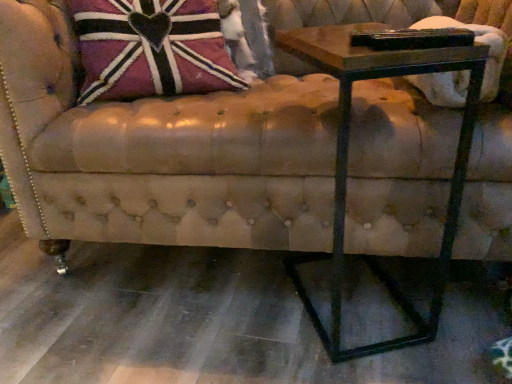
Locate an element on the screen. wooden table at right is located at coordinates (348, 149).

In order to click on wooden table at right in this screenshot , I will do `click(348, 149)`.

How different are the orientations of leather-like union jack pillow at upper left and wooden table at right in degrees?

leather-like union jack pillow at upper left and wooden table at right are facing 168 degrees away from each other.

Considering the relative sizes of leather-like union jack pillow at upper left and wooden table at right in the image provided, is leather-like union jack pillow at upper left wider than wooden table at right?

Incorrect, the width of leather-like union jack pillow at upper left does not surpass that of wooden table at right.

Can you confirm if leather-like union jack pillow at upper left is positioned to the left of wooden table at right?

Correct, you'll find leather-like union jack pillow at upper left to the left of wooden table at right.

The image size is (512, 384). Find the location of `throw pillow on the left of the wooden table at right`. throw pillow on the left of the wooden table at right is located at coordinates (160, 48).

Is leather couch at center located outside wooden table at right?

leather couch at center lies outside wooden table at right's area.

Which of these two, leather couch at center or wooden table at right, is wider?

With larger width is leather couch at center.

Is leather couch at center next to wooden table at right?

There is a gap between leather couch at center and wooden table at right.

From a real-world perspective, is wooden table at right beneath leather-like union jack pillow at upper left?

Yes, from a real-world perspective, wooden table at right is beneath leather-like union jack pillow at upper left.

Which is in front, point (443, 51) or point (208, 56)?

The point (443, 51) is closer.

Is wooden table at right bigger or smaller than leather-like union jack pillow at upper left?

In the image, wooden table at right appears to be larger than leather-like union jack pillow at upper left.

Are wooden table at right and leather couch at center far apart?

No, wooden table at right is in close proximity to leather couch at center.

Which object is further away from the camera, wooden table at right or leather couch at center?

leather couch at center is behind.

Is point (339, 297) farther from viewer compared to point (175, 234)?

That is True.

Based on the photo, which of these two, leather-like union jack pillow at upper left or leather couch at center, stands shorter?

leather-like union jack pillow at upper left.

Considering the positions of objects leather-like union jack pillow at upper left and leather couch at center in the image provided, who is in front, leather-like union jack pillow at upper left or leather couch at center?

leather couch at center is more forward.

From the image's perspective, which one is positioned lower, leather-like union jack pillow at upper left or leather couch at center?

leather couch at center appears lower in the image.

At what (x,y) coordinates should I click in order to perform the action: click on studio couch lying in front of the leather-like union jack pillow at upper left. Please return your answer as a coordinate pair (x, y). Image resolution: width=512 pixels, height=384 pixels. Looking at the image, I should click on (161, 152).

In order to click on throw pillow located behind the leather couch at center in this screenshot , I will do `click(160, 48)`.

Is point (307, 220) positioned in front of point (121, 65)?

Yes, it is in front of point (121, 65).

From their relative heights in the image, would you say leather couch at center is taller or shorter than leather-like union jack pillow at upper left?

leather couch at center is taller than leather-like union jack pillow at upper left.

Can you confirm if leather couch at center is bigger than leather-like union jack pillow at upper left?

Indeed, leather couch at center has a larger size compared to leather-like union jack pillow at upper left.

Find the location of a particular element. throw pillow above the wooden table at right (from the image's perspective) is located at coordinates (160, 48).

The height and width of the screenshot is (384, 512). Identify the location of studio couch that appears on the left of wooden table at right. (x=161, y=152).

Based on their spatial positions, is wooden table at right or leather-like union jack pillow at upper left further from leather couch at center?

The object further to leather couch at center is leather-like union jack pillow at upper left.

Which object lies further to the anchor point wooden table at right, leather couch at center or leather-like union jack pillow at upper left?

Based on the image, leather-like union jack pillow at upper left appears to be further to wooden table at right.

Based on their spatial positions, is leather-like union jack pillow at upper left or wooden table at right further from leather couch at center?

leather-like union jack pillow at upper left.

Estimate the real-world distances between objects in this image. Which object is closer to wooden table at right, leather-like union jack pillow at upper left or leather couch at center?

The object closer to wooden table at right is leather couch at center.

From the picture: Estimate the real-world distances between objects in this image. Which object is closer to leather-like union jack pillow at upper left, wooden table at right or leather couch at center?

leather couch at center is positioned closer to the anchor leather-like union jack pillow at upper left.

Which object lies nearer to the anchor point leather-like union jack pillow at upper left, leather couch at center or wooden table at right?

Based on the image, leather couch at center appears to be nearer to leather-like union jack pillow at upper left.

Image resolution: width=512 pixels, height=384 pixels. I want to click on studio couch between leather-like union jack pillow at upper left and wooden table at right, so click(161, 152).